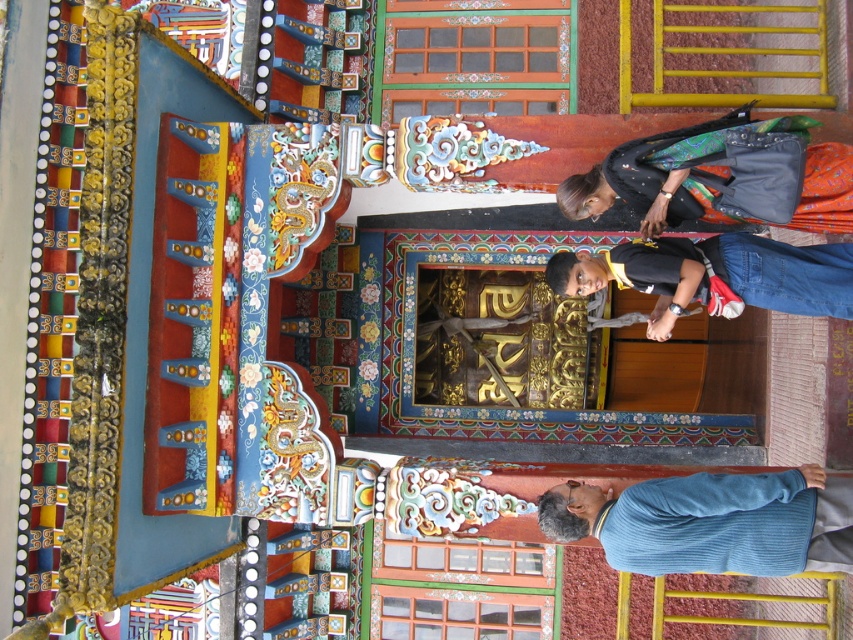
Who is higher up, blue corduroy sweater at lower right or black cotton shirt at upper right?

Positioned higher is black cotton shirt at upper right.

Which is in front, point (618, 541) or point (664, 276)?

Positioned in front is point (618, 541).

Does point (714, 534) come closer to viewer compared to point (727, 236)?

That is True.

At what (x,y) coordinates should I click in order to perform the action: click on blue corduroy sweater at lower right. Please return your answer as a coordinate pair (x, y). Looking at the image, I should click on (705, 522).